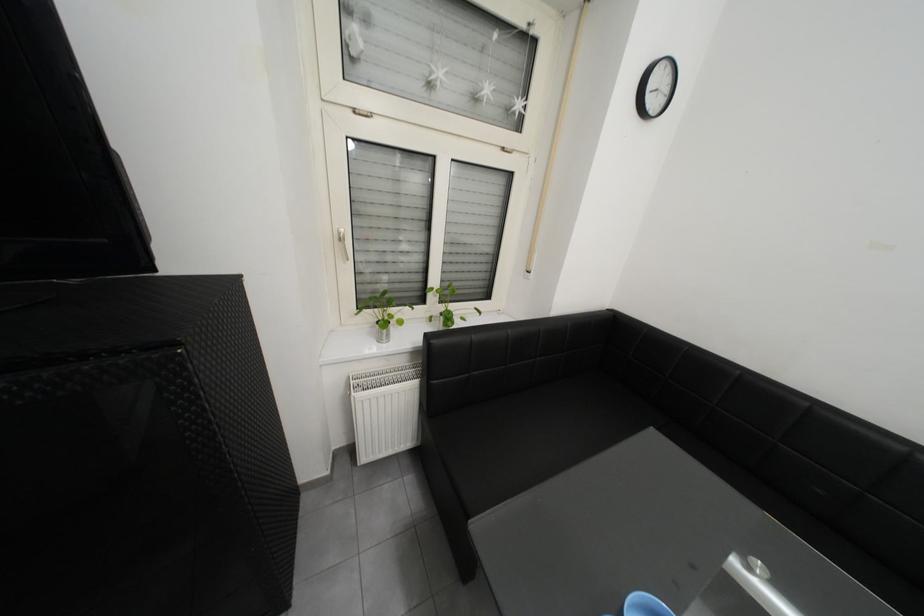
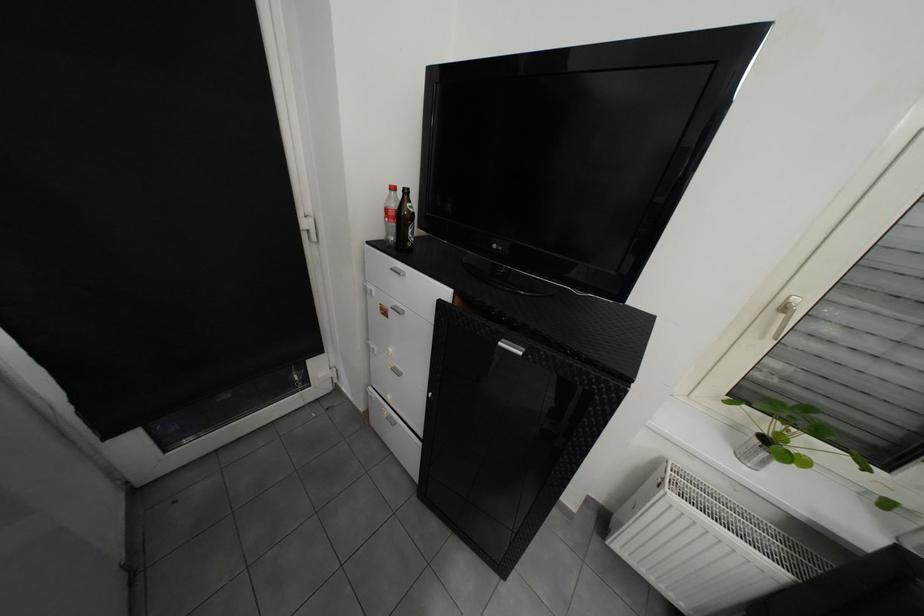
Question: The first image is from the beginning of the video and the second image is from the end. How did the camera likely rotate when shooting the video?

Choices:
 (A) Left
 (B) Right
 (C) Up
 (D) Down

Answer: (A)